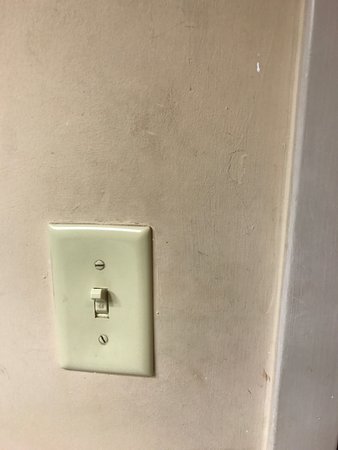
This screenshot has height=450, width=338. In order to click on trim in this screenshot , I will do `click(304, 389)`.